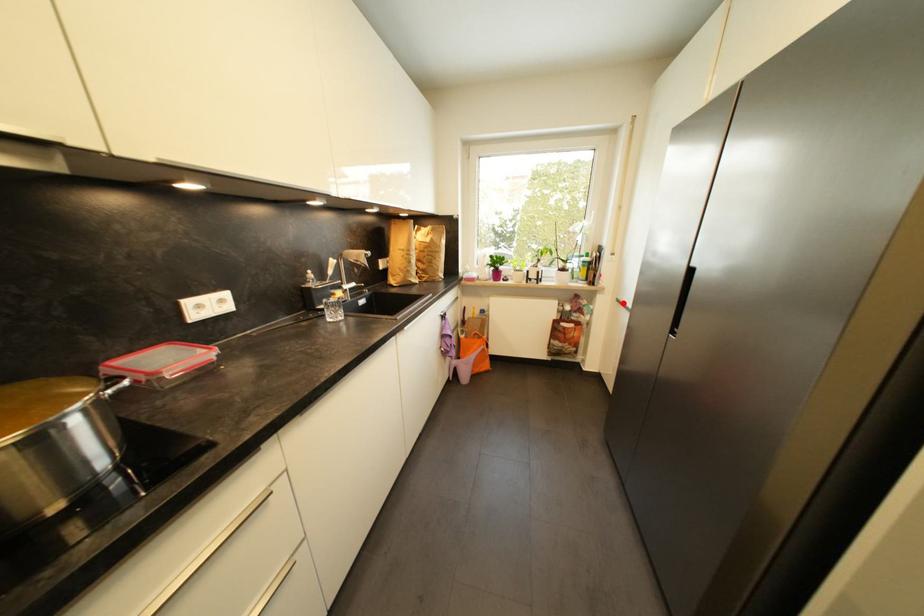
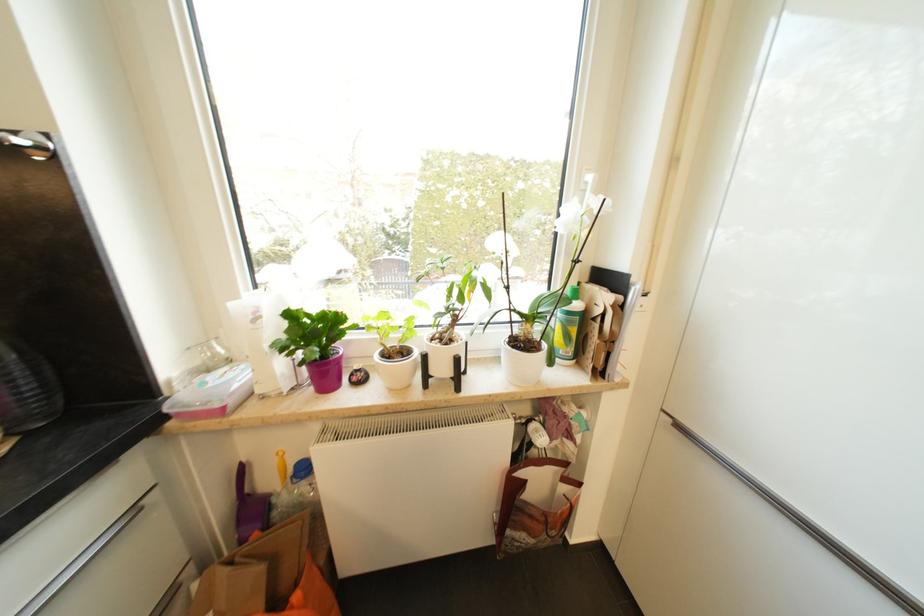
Question: I am providing you with two images of the same scene from different viewpoints. Image1 has a red point marked. In image2, the corresponding 3D location appears at what relative position? Reply with the corresponding letter.

Choices:
 (A) Closer
 (B) Farther

Answer: (B)